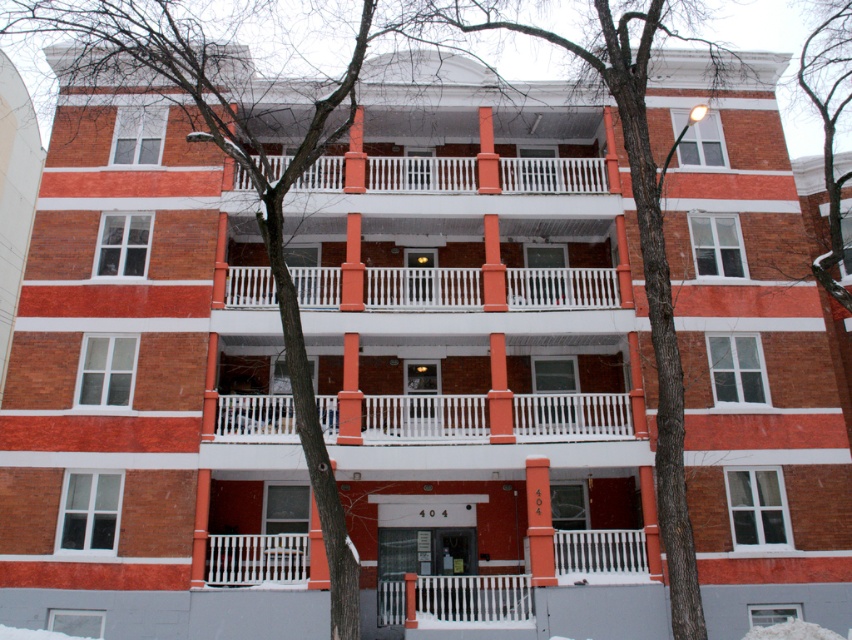
Question: Does smooth bark tree at center appear on the right side of white wooden railing at center?

Choices:
 (A) no
 (B) yes

Answer: (B)

Question: Which is nearer to the bare branches at upper center?

Choices:
 (A) smooth bark tree at center
 (B) white wooden railing at upper center
 (C) white painted wood balcony at center
 (D) white wooden railing at center

Answer: (A)

Question: Is white wooden railing at center thinner than bare branches at upper center?

Choices:
 (A) yes
 (B) no

Answer: (B)

Question: Among these points, which one is farthest from the camera?

Choices:
 (A) (563, 298)
 (B) (838, 220)
 (C) (401, 440)

Answer: (A)

Question: Is white painted wood balcony at center above white wooden railing at center?

Choices:
 (A) no
 (B) yes

Answer: (A)

Question: Among these points, which one is farthest from the camera?

Choices:
 (A) (815, 93)
 (B) (508, 278)
 (C) (695, 584)

Answer: (A)